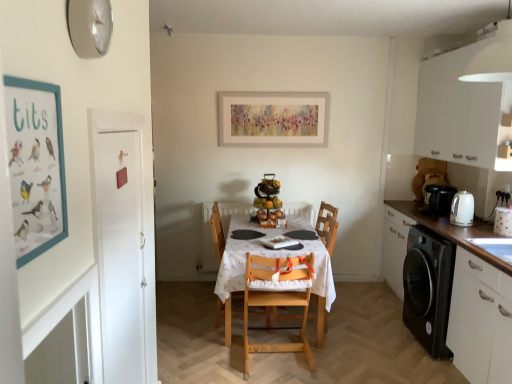
Question: From a real-world perspective, is white wood table at center physically located above or below matte cardboard poster at left?

Choices:
 (A) above
 (B) below

Answer: (B)

Question: In the image, is white wood table at center positioned in front of or behind matte cardboard poster at left?

Choices:
 (A) behind
 (B) front

Answer: (A)

Question: Based on their relative distances, which object is farther from the white ceramic kettle at right, acting as the first appliance starting from the right?

Choices:
 (A) matte cardboard poster at left
 (B) white matte cabinet at upper right, which is counted as the 1th cabinetry, starting from the top
 (C) natural wood highchair at center, arranged as the first chair when viewed from the front
 (D) white glossy electric kettle at right, arranged as the 1th appliance when viewed from the back
 (E) white wood table at center

Answer: (A)

Question: Which of these objects is positioned farthest from the white glossy cabinet at lower right, which is counted as the second cabinetry, starting from the top?

Choices:
 (A) white glossy electric kettle at right, the 2th appliance viewed from the front
 (B) white ceramic kettle at right, which is the second appliance from left to right
 (C) wooden highchair at center
 (D) matte cardboard poster at left
 (E) black plastic coffee machine at right

Answer: (D)